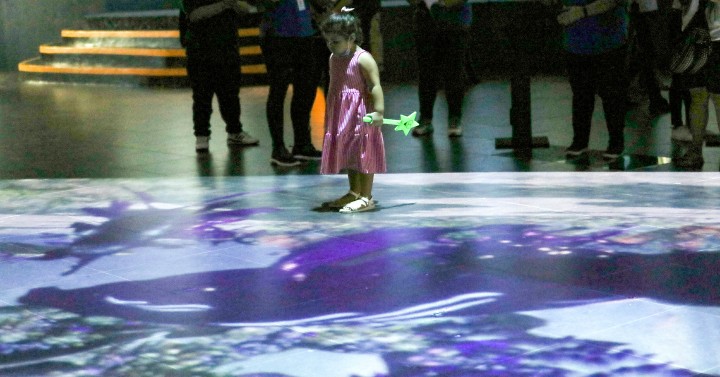
Locate an element on the screen. The height and width of the screenshot is (377, 720). shadows on floor is located at coordinates (127, 228), (338, 277), (487, 363), (89, 342).